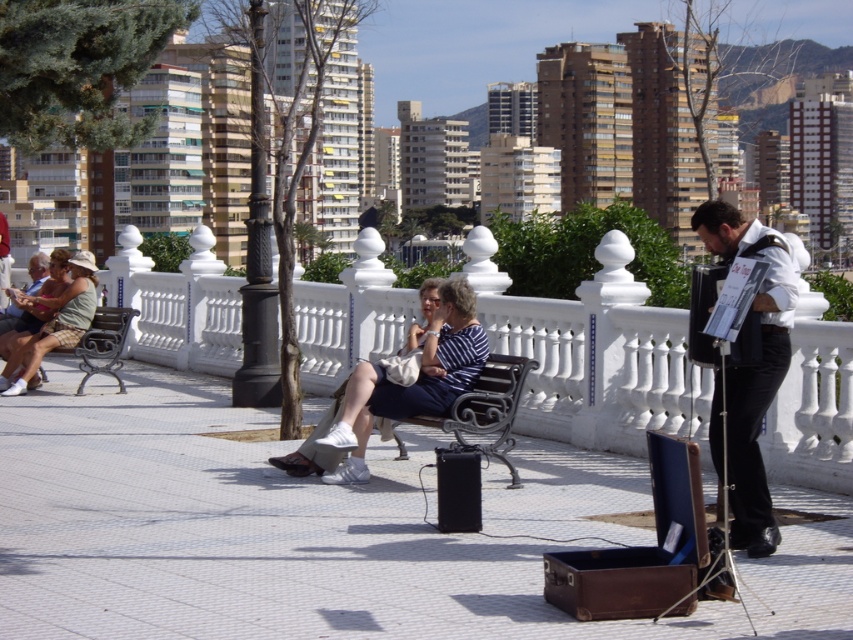
Question: Is white tile pavement at center above black velvet suit at right?

Choices:
 (A) yes
 (B) no

Answer: (B)

Question: Among these objects, which one is farthest from the camera?

Choices:
 (A) black velvet suit at right
 (B) white tile pavement at center
 (C) black wrought iron bench at left

Answer: (C)

Question: Which point is closer to the camera?

Choices:
 (A) white tile pavement at center
 (B) matte green dress at left

Answer: (A)

Question: Observing the image, what is the correct spatial positioning of white tile pavement at center in reference to black velvet suit at right?

Choices:
 (A) left
 (B) right

Answer: (A)

Question: Observing the image, what is the correct spatial positioning of black velvet suit at right in reference to black wrought iron bench at left?

Choices:
 (A) left
 (B) right

Answer: (B)

Question: Which of the following is the closest to the observer?

Choices:
 (A) (27, 378)
 (B) (337, 454)
 (C) (416, 557)
 (D) (165, 346)

Answer: (C)